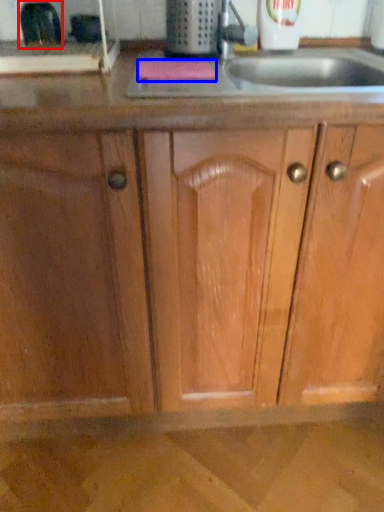
Question: Which of the following is the closest to the observer, appliance (highlighted by a red box) or soap (highlighted by a blue box)?

Choices:
 (A) appliance
 (B) soap

Answer: (B)